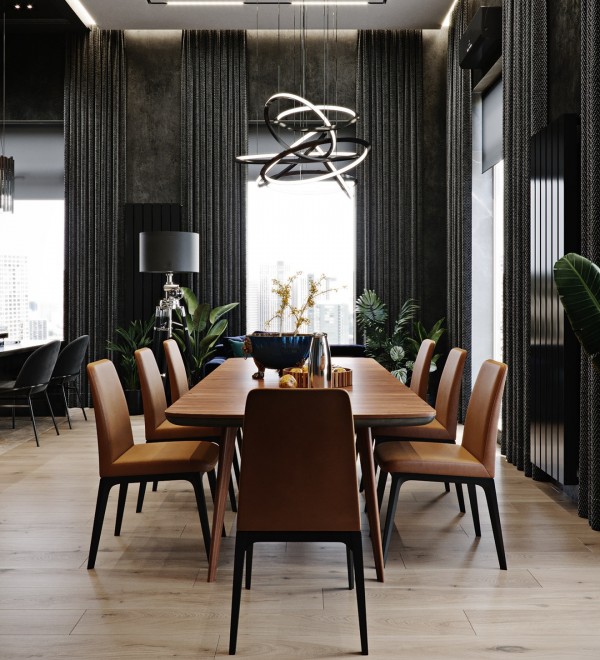
What are the coordinates of `legs of chair` in the screenshot? It's located at (232, 599), (361, 598), (388, 521), (496, 519), (476, 513), (97, 521), (203, 510).